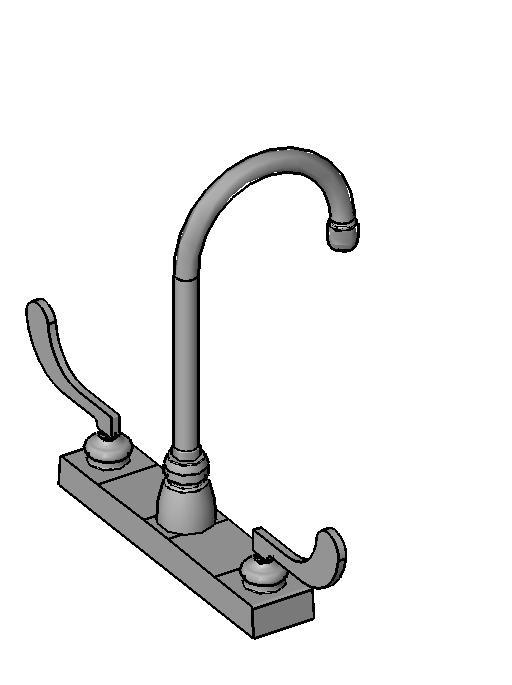
Identify the location of 1 knob on the left side. This screenshot has width=512, height=685. (47, 340).